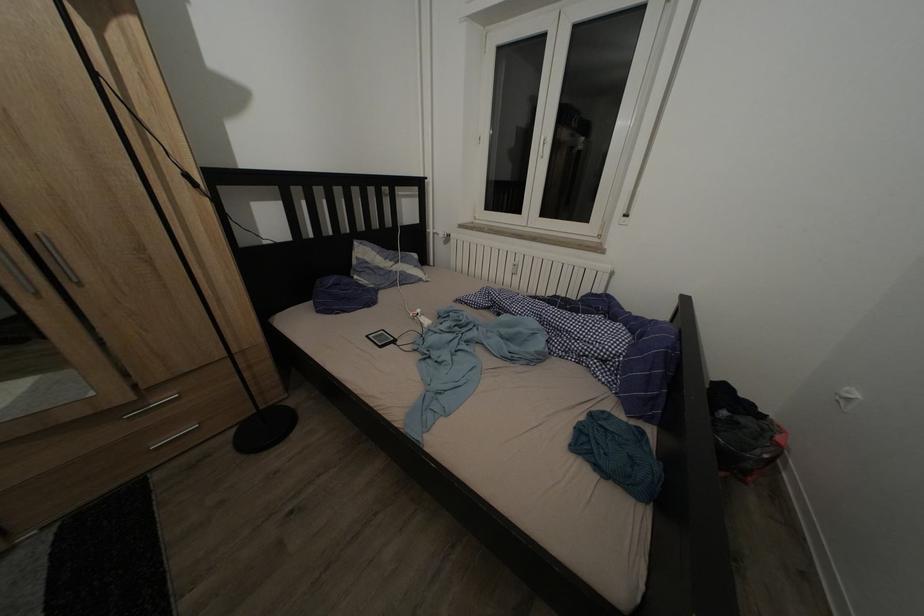
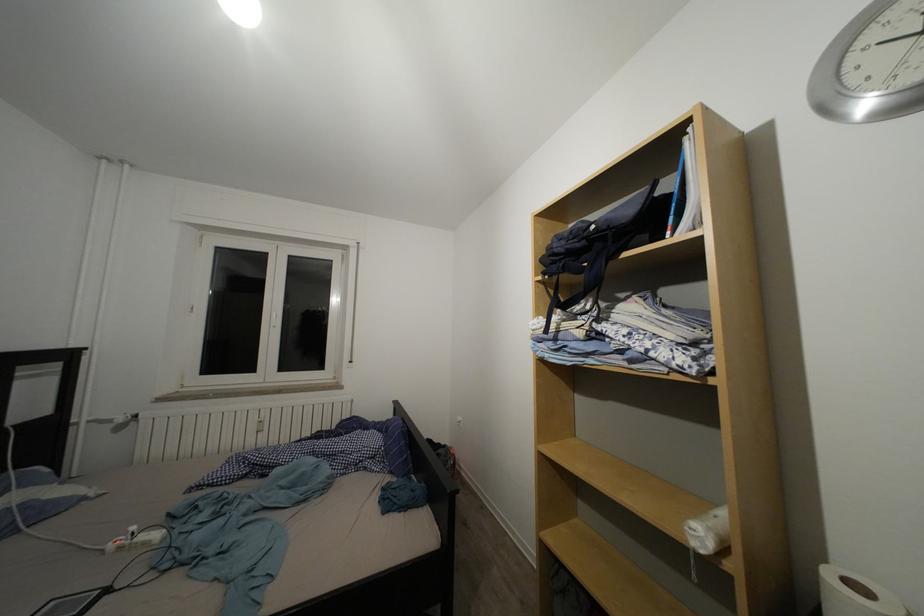
Based on the continuous images, in which direction is the camera rotating?

The rotation direction of the camera is right-up.